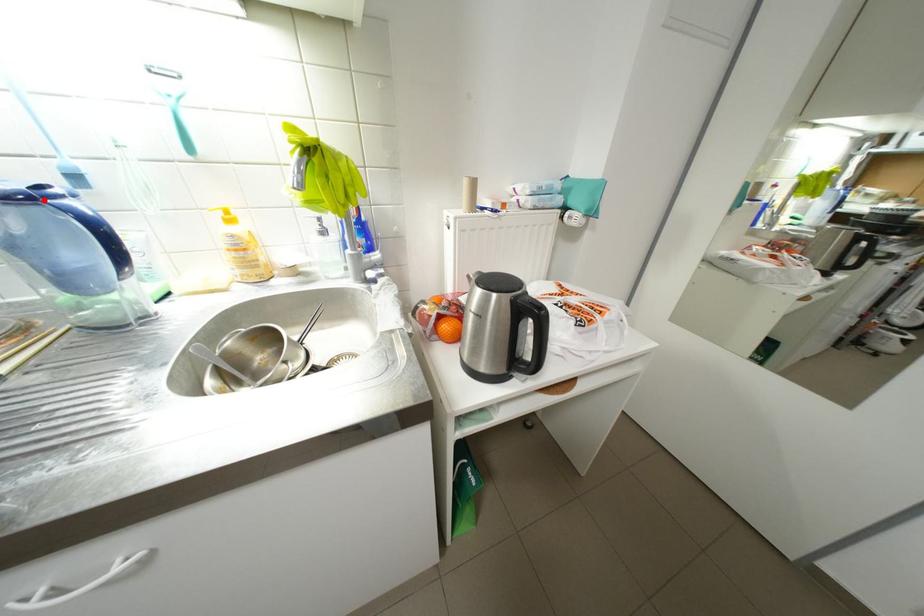
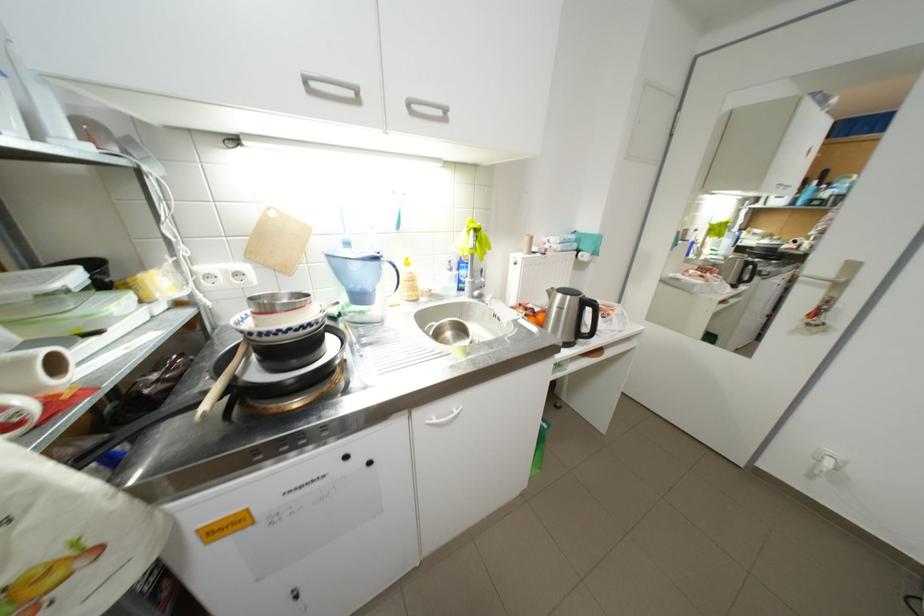
Question: I am providing you with two images of the same scene from different viewpoints. Given a red point in image1, look at the same physical point in image2. Is it:

Choices:
 (A) Closer to the viewpoint
 (B) Farther from the viewpoint

Answer: (A)